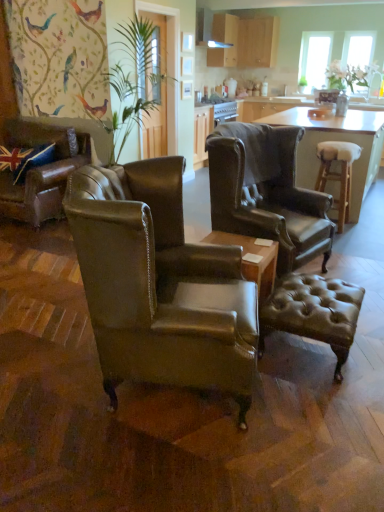
Image resolution: width=384 pixels, height=512 pixels. I want to click on translucent glass window at upper right, positioned as the first window screen in right-to-left order, so click(357, 58).

What do you see at coordinates (333, 140) in the screenshot? The width and height of the screenshot is (384, 512). I see `wooden bar stool at right` at bounding box center [333, 140].

The image size is (384, 512). Identify the location of wooden cabinet at upper center, the first cabinetry when ordered from right to left. (244, 41).

You are a GUI agent. You are given a task and a screenshot of the screen. Output one action in this format:
    pyautogui.click(x=<x>, y=<y>)
    Task: Click on the transparent glass window at upper right, placed as the 2th window screen when sorted from right to left
    
    Given the screenshot: What is the action you would take?
    pyautogui.click(x=314, y=58)

At what (x,y) coordinates should I click in order to perform the action: click on translucent glass window at upper right, the second window screen from the left. Please return your answer as a coordinate pair (x, y). Looking at the image, I should click on [x=357, y=58].

From a real-world perspective, which object rests below the other?

leather wingback chair at center, which is the third chair from left to right, is physically lower.

Is leather wingback chair at center, marked as the 1th chair in a right-to-left arrangement, to the left of wooden cabinet at upper center, the second cabinetry when ordered from left to right, from the viewer's perspective?

Yes, leather wingback chair at center, marked as the 1th chair in a right-to-left arrangement, is to the left of wooden cabinet at upper center, the second cabinetry when ordered from left to right.

Considering the sizes of objects leather wingback chair at center, which is the third chair from left to right, and wooden cabinet at upper center, the second cabinetry when ordered from left to right, in the image provided, who is taller, leather wingback chair at center, which is the third chair from left to right, or wooden cabinet at upper center, the second cabinetry when ordered from left to right,?

With more height is leather wingback chair at center, which is the third chair from left to right.

Measure the distance from leather wingback chair at center, marked as the 1th chair in a right-to-left arrangement, to wooden cabinet at upper center, the first cabinetry when ordered from right to left.

leather wingback chair at center, marked as the 1th chair in a right-to-left arrangement, is 3.73 meters away from wooden cabinet at upper center, the first cabinetry when ordered from right to left.

How distant is transparent glass window at upper right, placed as the 2th window screen when sorted from right to left, from matte wood exhaust hood at upper center?

A distance of 4.84 feet exists between transparent glass window at upper right, placed as the 2th window screen when sorted from right to left, and matte wood exhaust hood at upper center.

Based on the photo, from a real-world perspective, which is physically above, transparent glass window at upper right, the first window screen when ordered from left to right, or matte wood exhaust hood at upper center?

From a 3D spatial view, matte wood exhaust hood at upper center is above.

Is transparent glass window at upper right, the first window screen when ordered from left to right, to the left or to the right of matte wood exhaust hood at upper center in the image?

transparent glass window at upper right, the first window screen when ordered from left to right, is positioned on matte wood exhaust hood at upper center's right side.

Do you think transparent glass window at upper right, the first window screen when ordered from left to right, is within matte wood exhaust hood at upper center, or outside of it?

transparent glass window at upper right, the first window screen when ordered from left to right, exists outside the volume of matte wood exhaust hood at upper center.

Considering the sizes of objects leather wingback chair at left, which is the 3th chair from right to left, and brown leather ottoman at center in the image provided, who is bigger, leather wingback chair at left, which is the 3th chair from right to left, or brown leather ottoman at center?

Bigger between the two is leather wingback chair at left, which is the 3th chair from right to left.

Is there a large distance between leather wingback chair at left, the first chair from the left, and brown leather ottoman at center?

leather wingback chair at left, the first chair from the left, is positioned a significant distance from brown leather ottoman at center.

Based on the photo, which object is further away from the camera, leather wingback chair at left, which is the 3th chair from right to left, or brown leather ottoman at center?

leather wingback chair at left, which is the 3th chair from right to left.

Would you say leather wingback chair at center, which ranks as the first chair in front-to-back order, is inside or outside matte wood exhaust hood at upper center?

leather wingback chair at center, which ranks as the first chair in front-to-back order, is spatially situated outside matte wood exhaust hood at upper center.

Is leather wingback chair at center, the third chair when ordered from back to front, positioned behind matte wood exhaust hood at upper center?

No, it is in front of matte wood exhaust hood at upper center.

From a real-world perspective, which object rests below the other?

In real-world perspective, leather wingback chair at center, the 2th chair in the right-to-left sequence, is lower.

How different are the orientations of leather wingback chair at center, the 2th chair in the right-to-left sequence, and matte wood exhaust hood at upper center in degrees?

They differ by 20.8 degrees in their facing directions.

Considering the sizes of objects leather wingback chair at center, the third chair when ordered from back to front, and leather wingback chair at left, which is the 3th chair from right to left, in the image provided, who is smaller, leather wingback chair at center, the third chair when ordered from back to front, or leather wingback chair at left, which is the 3th chair from right to left,?

leather wingback chair at left, which is the 3th chair from right to left, is smaller.

Is leather wingback chair at center, which ranks as the first chair in front-to-back order, positioned with its back to leather wingback chair at left, which ranks as the 3th chair in front-to-back order?

No, leather wingback chair at center, which ranks as the first chair in front-to-back order, is not facing the opposite direction of leather wingback chair at left, which ranks as the 3th chair in front-to-back order.

Is leather wingback chair at center, the 2th chair in the right-to-left sequence, not close to leather wingback chair at left, the 1th chair positioned from the back?

leather wingback chair at center, the 2th chair in the right-to-left sequence, is far away from leather wingback chair at left, the 1th chair positioned from the back.

Who is bigger, transparent glass window at upper right, placed as the 2th window screen when sorted from right to left, or leather wingback chair at center, the 2th chair in the right-to-left sequence?

leather wingback chair at center, the 2th chair in the right-to-left sequence.

Which of these two, transparent glass window at upper right, the first window screen when ordered from left to right, or leather wingback chair at center, the 2th chair in the right-to-left sequence, is wider?

leather wingback chair at center, the 2th chair in the right-to-left sequence.

From a real-world perspective, starting from the transparent glass window at upper right, the first window screen when ordered from left to right, which chair is the 2nd one below it? Please provide its 2D coordinates.

[(159, 284)]

Which object is closer to the camera taking this photo, leather wingback chair at center, the 2th chair in the right-to-left sequence, or leather wingback chair at center, which is the third chair from left to right?

leather wingback chair at center, the 2th chair in the right-to-left sequence, is in front.

From the image's perspective, is leather wingback chair at center, the second chair in the left-to-right sequence, positioned above or below leather wingback chair at center, the 2th chair positioned from the back?

Clearly, from the image's perspective, leather wingback chair at center, the second chair in the left-to-right sequence, is below leather wingback chair at center, the 2th chair positioned from the back.

Considering the positions of objects leather wingback chair at center, the second chair in the left-to-right sequence, and leather wingback chair at center, which is the second chair in front-to-back order, in the image provided, who is more to the right, leather wingback chair at center, the second chair in the left-to-right sequence, or leather wingback chair at center, which is the second chair in front-to-back order,?

leather wingback chair at center, which is the second chair in front-to-back order, is more to the right.

Could you tell me if leather wingback chair at center, which ranks as the first chair in front-to-back order, is facing leather wingback chair at center, which is the second chair in front-to-back order?

No, leather wingback chair at center, which ranks as the first chair in front-to-back order, does not turn towards leather wingback chair at center, which is the second chair in front-to-back order.

Where is `the 2nd cabinetry to the right of the leather wingback chair at center, marked as the 1th chair in a right-to-left arrangement, counting from the anchor's position`? This screenshot has width=384, height=512. the 2nd cabinetry to the right of the leather wingback chair at center, marked as the 1th chair in a right-to-left arrangement, counting from the anchor's position is located at coordinates (244, 41).

Find the location of a particular element. Image resolution: width=384 pixels, height=512 pixels. exhaust hood above the transparent glass window at upper right, the first window screen when ordered from left to right (from the image's perspective) is located at coordinates (207, 30).

Looking at the image, which one is located closer to clear glass door at upper center, wooden cabinet at upper center, the second cabinetry when ordered from left to right, or leather wingback chair at center, the third chair when ordered from back to front?

wooden cabinet at upper center, the second cabinetry when ordered from left to right.

Based on their spatial positions, is wooden bar stool at right or matte wood exhaust hood at upper center closer to light brown wooden stool at right?

A: Among the two, wooden bar stool at right is located nearer to light brown wooden stool at right.

Considering their positions, is light brown wooden stool at right positioned closer to matte wood cabinets at upper center, arranged as the 1th cabinetry when viewed from the left, than leather wingback chair at left, the first chair from the left?

The object closer to matte wood cabinets at upper center, arranged as the 1th cabinetry when viewed from the left, is light brown wooden stool at right.

Consider the image. Considering their positions, is translucent glass window at upper right, the second window screen from the left, positioned further to matte wood cabinets at upper center, arranged as the 1th cabinetry when viewed from the left, than transparent glass window at upper right, the first window screen when ordered from left to right?

The object further to matte wood cabinets at upper center, arranged as the 1th cabinetry when viewed from the left, is translucent glass window at upper right, the second window screen from the left.

Estimate the real-world distances between objects in this image. Which object is further from matte wood exhaust hood at upper center, leather wingback chair at center, which is the second chair in front-to-back order, or leather wingback chair at left, the first chair from the left?

Among the two, leather wingback chair at center, which is the second chair in front-to-back order, is located further to matte wood exhaust hood at upper center.

Looking at the image, which one is located further to matte wood exhaust hood at upper center, leather wingback chair at left, which is the 3th chair from right to left, or transparent glass window at upper right, the first window screen when ordered from left to right?

The object further to matte wood exhaust hood at upper center is leather wingback chair at left, which is the 3th chair from right to left.

When comparing their distances from wooden bar stool at right, does clear glass door at upper center or transparent glass window at upper right, placed as the 2th window screen when sorted from right to left, seem further?

The object further to wooden bar stool at right is transparent glass window at upper right, placed as the 2th window screen when sorted from right to left.

Considering their positions, is light brown wooden stool at right positioned closer to clear glass door at upper center than leather wingback chair at center, the 2th chair in the right-to-left sequence?

Based on the image, light brown wooden stool at right appears to be nearer to clear glass door at upper center.

This screenshot has width=384, height=512. I want to click on bar stool between clear glass door at upper center and wooden bar stool at right, so click(x=338, y=174).

The image size is (384, 512). What are the coordinates of `footrest between leather wingback chair at center, the second chair in the left-to-right sequence, and wooden cabinet at upper center, the first cabinetry when ordered from right to left, along the z-axis` in the screenshot? It's located at (314, 312).

Find the location of a particular element. Image resolution: width=384 pixels, height=512 pixels. bar stool positioned between brown leather ottoman at center and wooden bar stool at right from near to far is located at coordinates (338, 174).

Identify the location of glass door between matte wood exhaust hood at upper center and leather wingback chair at left, the first chair from the left, from top to bottom. The image size is (384, 512). (169, 66).